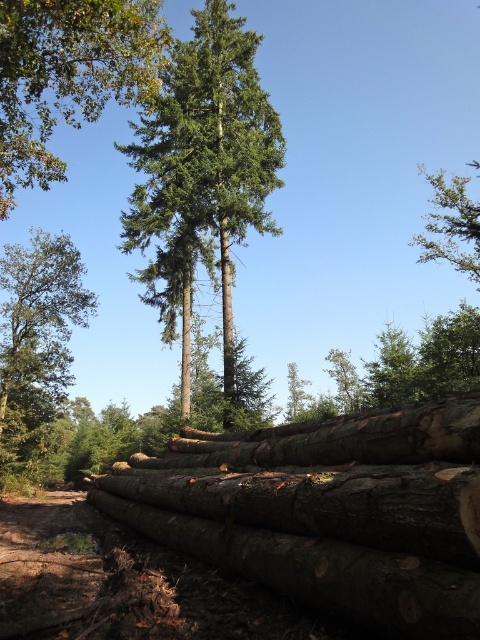
You are standing at the center of the forest scene. There is a green textured tree at center. Where is the green textured tree located in relation to your position?

The green textured tree at center is located at point (207, 154) relative to your position.

You are a hiker standing in the forest scene described. You notice two trees in your view. The first is the green textured tree at center, and the second is the green matte tree at left. Which tree appears higher up in your field of view?

The green textured tree at center appears higher up in the field of view because it is located above the green matte tree at left.